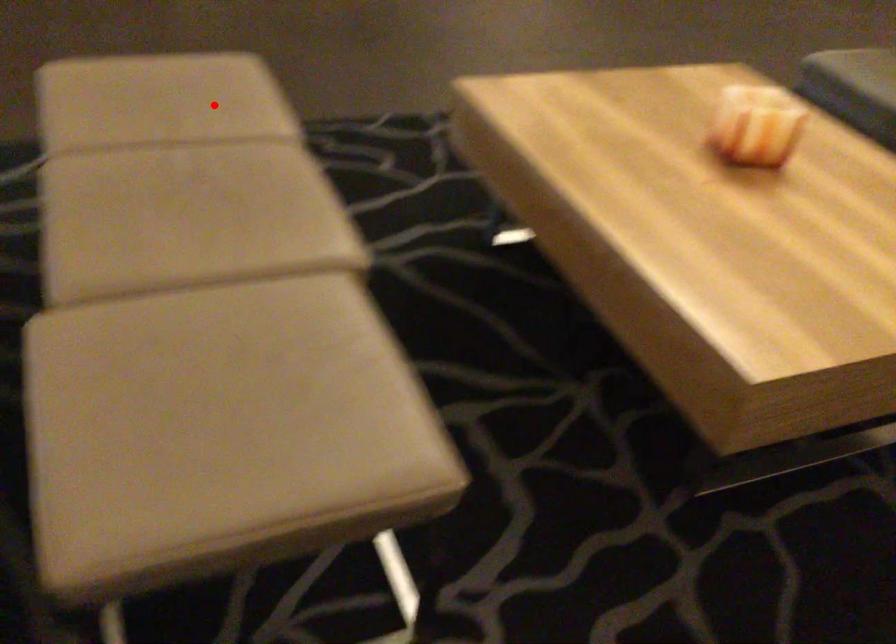
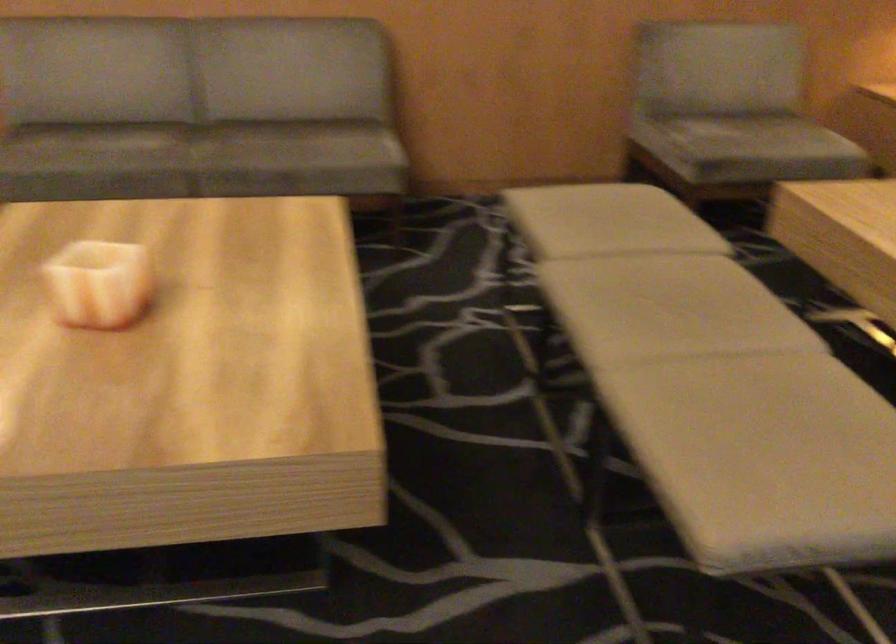
Question: I am providing you with two images of the same scene from different viewpoints. In image1, a red point is highlighted. Considering the same 3D point in image2, which of the following is correct?

Choices:
 (A) It is closer
 (B) It is farther

Answer: (A)